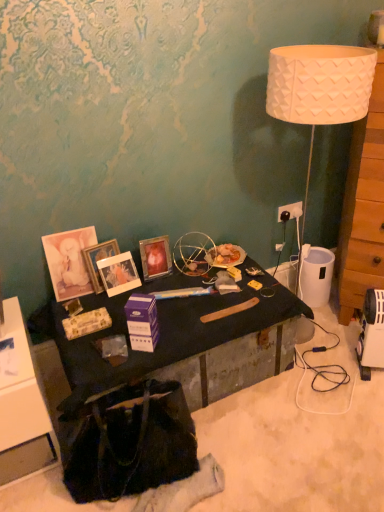
Identify the location of white plastic power outlet at upper right. (x=291, y=210).

In order to face matte wooden picture frame at center left, positioned as the 1th picture frame in left-to-right order, should I rotate leftwards or rightwards?

To face it directly, rotate left by 11.514 degrees.

Measure the distance between matte wooden picture frame at center left, the third picture frame in the right-to-left sequence, and camera.

matte wooden picture frame at center left, the third picture frame in the right-to-left sequence, and camera are 5.88 feet apart.

What is the approximate width of metallic gold picture frame at center, acting as the second picture frame starting from the left?

It is 1.71 inches.

Locate an element on the screen. white plastic power outlet at upper right is located at coordinates (291, 210).

Is matte black cabinet at lower left next to wooden dresser at right and touching it?

No, matte black cabinet at lower left is not making contact with wooden dresser at right.

Does matte black cabinet at lower left contain wooden dresser at right?

No, matte black cabinet at lower left does not contain wooden dresser at right.

Is point (15, 467) positioned in front of point (380, 262)?

That is True.

Is metallic gold picture frame at center, arranged as the third picture frame when viewed from the left, far from black matte desk at center?

metallic gold picture frame at center, arranged as the third picture frame when viewed from the left, is actually quite close to black matte desk at center.

From the image's perspective, who appears lower, metallic gold picture frame at center, arranged as the third picture frame when viewed from the left, or black matte desk at center?

black matte desk at center appears lower in the image.

Does point (156, 262) lie behind point (167, 302)?

Yes, point (156, 262) is behind point (167, 302).

Could you tell me if metallic gold picture frame at center, marked as the first picture frame in a right-to-left arrangement, is turned towards black matte desk at center?

Yes, metallic gold picture frame at center, marked as the first picture frame in a right-to-left arrangement, is aimed at black matte desk at center.

Consider the image. Considering the sizes of objects matte wooden picture frame at center left, the third picture frame in the right-to-left sequence, and white plastic power outlet at upper right in the image provided, who is wider, matte wooden picture frame at center left, the third picture frame in the right-to-left sequence, or white plastic power outlet at upper right?

white plastic power outlet at upper right.

Between point (92, 277) and point (278, 211), which one is positioned in front?

The point (92, 277) is more forward.

Are matte wooden picture frame at center left, positioned as the 1th picture frame in left-to-right order, and white plastic power outlet at upper right far apart?

They are positioned close to each other.

Between matte wooden picture frame at center left, the third picture frame in the right-to-left sequence, and white plastic power outlet at upper right, which one has smaller size?

With smaller size is white plastic power outlet at upper right.

From the image's perspective, relative to matte black cabinet at lower left, is matte wooden picture frame at center left, the third picture frame in the right-to-left sequence, above or below?

matte wooden picture frame at center left, the third picture frame in the right-to-left sequence, is above matte black cabinet at lower left.

Is matte wooden picture frame at center left, the third picture frame in the right-to-left sequence, to the left or to the right of matte black cabinet at lower left in the image?

matte wooden picture frame at center left, the third picture frame in the right-to-left sequence, is to the right of matte black cabinet at lower left.

Which of these two, matte wooden picture frame at center left, positioned as the 1th picture frame in left-to-right order, or matte black cabinet at lower left, stands taller?

matte black cabinet at lower left is taller.

Is matte wooden picture frame at center left, the third picture frame in the right-to-left sequence, looking in the opposite direction of matte black cabinet at lower left?

matte wooden picture frame at center left, the third picture frame in the right-to-left sequence, is not turned away from matte black cabinet at lower left.

In the scene shown: From the image's perspective, which is above, metallic gold picture frame at center, the 2th picture frame in the right-to-left sequence, or black matte desk at center?

metallic gold picture frame at center, the 2th picture frame in the right-to-left sequence, from the image's perspective.

Is metallic gold picture frame at center, the 2th picture frame in the right-to-left sequence, taller or shorter than black matte desk at center?

Considering their sizes, metallic gold picture frame at center, the 2th picture frame in the right-to-left sequence, has more height than black matte desk at center.

From a real-world perspective, is metallic gold picture frame at center, the 2th picture frame in the right-to-left sequence, on top of black matte desk at center?

Yes, from a real-world perspective, metallic gold picture frame at center, the 2th picture frame in the right-to-left sequence, is over black matte desk at center

Considering their positions, is metallic gold picture frame at center, acting as the second picture frame starting from the left, located in front of or behind black matte desk at center?

metallic gold picture frame at center, acting as the second picture frame starting from the left, is positioned farther from the viewer than black matte desk at center.

Considering the relative sizes of white plastic power outlet at upper right and metallic gold picture frame at center, arranged as the third picture frame when viewed from the left, in the image provided, is white plastic power outlet at upper right smaller than metallic gold picture frame at center, arranged as the third picture frame when viewed from the left,?

Correct, white plastic power outlet at upper right occupies less space than metallic gold picture frame at center, arranged as the third picture frame when viewed from the left.

From the image's perspective, between white plastic power outlet at upper right and metallic gold picture frame at center, marked as the first picture frame in a right-to-left arrangement, which one is located above?

white plastic power outlet at upper right, from the image's perspective.

At what (x,y) coordinates should I click in order to perform the action: click on power outlet above the metallic gold picture frame at center, marked as the first picture frame in a right-to-left arrangement (from the image's perspective). Please return your answer as a coordinate pair (x, y). Looking at the image, I should click on (291, 210).

How different are the orientations of matte wooden picture frame at center left, positioned as the 1th picture frame in left-to-right order, and metallic gold picture frame at center, the 2th picture frame in the right-to-left sequence, in degrees?

There is a 3.59-degree angle between the facing directions of matte wooden picture frame at center left, positioned as the 1th picture frame in left-to-right order, and metallic gold picture frame at center, the 2th picture frame in the right-to-left sequence.

Considering the positions of objects matte wooden picture frame at center left, positioned as the 1th picture frame in left-to-right order, and metallic gold picture frame at center, acting as the second picture frame starting from the left, in the image provided, who is behind, matte wooden picture frame at center left, positioned as the 1th picture frame in left-to-right order, or metallic gold picture frame at center, acting as the second picture frame starting from the left,?

metallic gold picture frame at center, acting as the second picture frame starting from the left, is behind.

Does matte wooden picture frame at center left, the third picture frame in the right-to-left sequence, have a larger size compared to metallic gold picture frame at center, the 2th picture frame in the right-to-left sequence?

No.

Which of these two, matte wooden picture frame at center left, the third picture frame in the right-to-left sequence, or metallic gold picture frame at center, the 2th picture frame in the right-to-left sequence, is wider?

With larger width is metallic gold picture frame at center, the 2th picture frame in the right-to-left sequence.

Locate an element on the screen. This screenshot has width=384, height=512. dresser on the right of matte black cabinet at lower left is located at coordinates (362, 213).

From a real-world perspective, which picture frame is the 2nd one above the black matte desk at center? Please provide its 2D coordinates.

[(155, 257)]

Estimate the real-world distances between objects in this image. Which object is further from matte wooden picture frame at center left, positioned as the 1th picture frame in left-to-right order, black fabric handbag at lower left or wooden dresser at right?

wooden dresser at right lies further to matte wooden picture frame at center left, positioned as the 1th picture frame in left-to-right order, than the other object.

Which object lies nearer to the anchor point metallic gold picture frame at center, arranged as the third picture frame when viewed from the left, white plastic power outlet at upper right or purple cardboard box at center?

purple cardboard box at center lies closer to metallic gold picture frame at center, arranged as the third picture frame when viewed from the left, than the other object.

Considering their positions, is black fabric handbag at lower left positioned closer to purple cardboard box at center than black matte desk at center?

Based on the image, black matte desk at center appears to be nearer to purple cardboard box at center.

Estimate the real-world distances between objects in this image. Which object is closer to wooden dresser at right, matte wooden picture frame at center left, the third picture frame in the right-to-left sequence, or matte black cabinet at lower left?

matte wooden picture frame at center left, the third picture frame in the right-to-left sequence.

Estimate the real-world distances between objects in this image. Which object is further from matte black cabinet at lower left, purple cardboard box at center or wooden dresser at right?

Among the two, wooden dresser at right is located further to matte black cabinet at lower left.

Considering their positions, is purple cardboard box at center positioned further to matte black cabinet at lower left than black matte desk at center?

black matte desk at center is further to matte black cabinet at lower left.

When comparing their distances from purple cardboard box at center, does matte wooden picture frame at center left, positioned as the 1th picture frame in left-to-right order, or metallic gold picture frame at center, acting as the second picture frame starting from the left, seem further?

Among the two, matte wooden picture frame at center left, positioned as the 1th picture frame in left-to-right order, is located further to purple cardboard box at center.

When comparing their distances from black fabric handbag at lower left, does matte black cabinet at lower left or purple cardboard box at center seem closer?

matte black cabinet at lower left.

At what (x,y) coordinates should I click in order to perform the action: click on power outlet between matte black cabinet at lower left and wooden dresser at right. Please return your answer as a coordinate pair (x, y). The image size is (384, 512). Looking at the image, I should click on (291, 210).

You are a GUI agent. You are given a task and a screenshot of the screen. Output one action in this format:
    pyautogui.click(x=<x>, y=<y>)
    Task: Click on the desk between metallic gold picture frame at center, the 2th picture frame in the right-to-left sequence, and white plastic power outlet at upper right from left to right
    The image size is (384, 512).
    Given the screenshot: What is the action you would take?
    pyautogui.click(x=189, y=342)

You are a GUI agent. You are given a task and a screenshot of the screen. Output one action in this format:
    pyautogui.click(x=<x>, y=<y>)
    Task: Click on the picture frame between metallic gold picture frame at center, the 2th picture frame in the right-to-left sequence, and wooden dresser at right from left to right
    
    Given the screenshot: What is the action you would take?
    pyautogui.click(x=155, y=257)

Where is `desk between metallic gold picture frame at center, acting as the second picture frame starting from the left, and black fabric handbag at lower left, in the vertical direction`? Image resolution: width=384 pixels, height=512 pixels. desk between metallic gold picture frame at center, acting as the second picture frame starting from the left, and black fabric handbag at lower left, in the vertical direction is located at coordinates (189, 342).